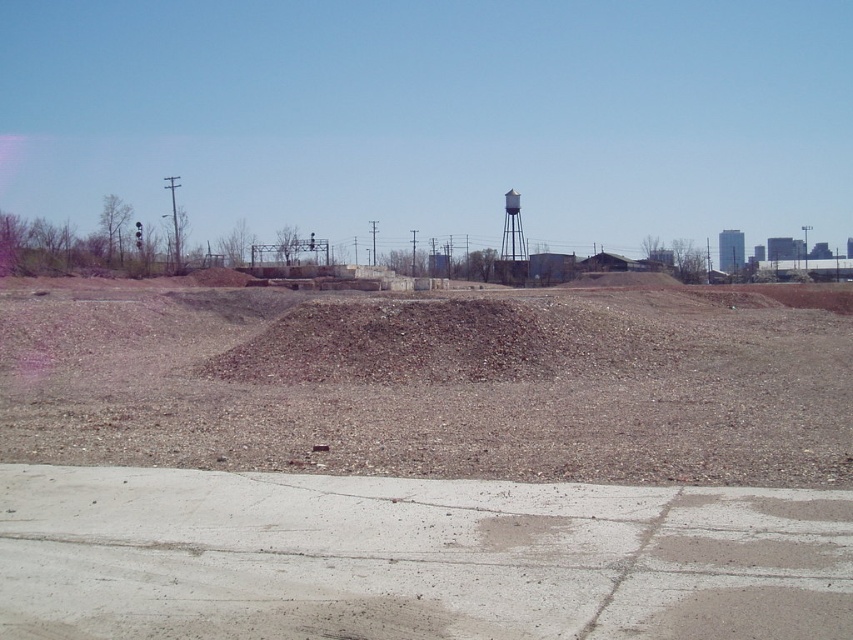
Does gray concrete dirt track at lower center have a lesser width compared to white painted metal water tower at upper center?

Yes, gray concrete dirt track at lower center is thinner than white painted metal water tower at upper center.

Does gray concrete dirt track at lower center appear on the left side of white painted metal water tower at upper center?

Indeed, gray concrete dirt track at lower center is positioned on the left side of white painted metal water tower at upper center.

Who is more forward, (526,483) or (503,220)?

Point (526,483) is in front.

In order to click on gray concrete dirt track at lower center in this screenshot , I will do `click(413, 557)`.

Does brown gravel at center have a greater height compared to white painted metal water tower at upper center?

No, brown gravel at center is not taller than white painted metal water tower at upper center.

Is brown gravel at center shorter than white painted metal water tower at upper center?

Yes.

Is point (674, 417) farther from viewer compared to point (511, 209)?

No, (674, 417) is in front of (511, 209).

The width and height of the screenshot is (853, 640). Identify the location of brown gravel at center. (434, 390).

Consider the image. Is brown gravel at center smaller than gray concrete dirt track at lower center?

No.

Is brown gravel at center to the left of gray concrete dirt track at lower center from the viewer's perspective?

Incorrect, brown gravel at center is not on the left side of gray concrete dirt track at lower center.

Who is more distant from viewer, (608,292) or (712,636)?

Positioned behind is point (608,292).

Locate an element on the screen. The image size is (853, 640). brown gravel at center is located at coordinates (434, 390).